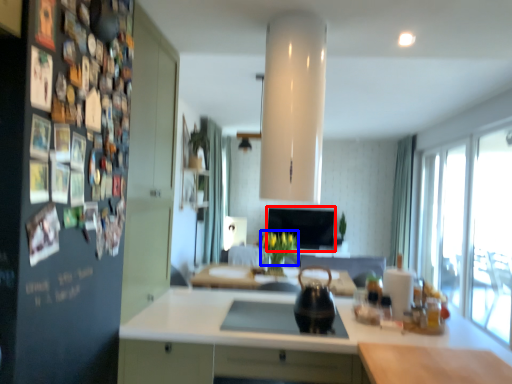
Question: Which point is further to the camera, window screen (highlighted by a red box) or flower (highlighted by a blue box)?

Choices:
 (A) window screen
 (B) flower

Answer: (A)